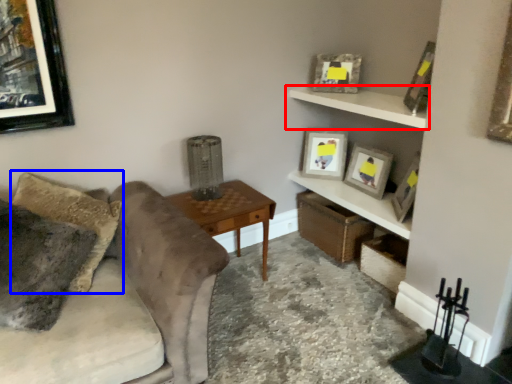
Question: Which object is further to the camera taking this photo, shelf (highlighted by a red box) or pillow (highlighted by a blue box)?

Choices:
 (A) shelf
 (B) pillow

Answer: (A)